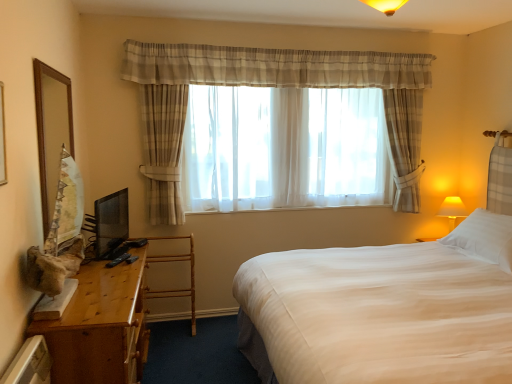
Question: Does sheer fabric bay window at center turn towards white soft pillow at upper right?

Choices:
 (A) yes
 (B) no

Answer: (A)

Question: Is there a large distance between sheer fabric bay window at center and white soft pillow at upper right?

Choices:
 (A) no
 (B) yes

Answer: (B)

Question: Does sheer fabric bay window at center have a lesser width compared to white soft pillow at upper right?

Choices:
 (A) yes
 (B) no

Answer: (A)

Question: Is sheer fabric bay window at center shorter than white soft pillow at upper right?

Choices:
 (A) no
 (B) yes

Answer: (A)

Question: From a real-world perspective, is sheer fabric bay window at center beneath white soft pillow at upper right?

Choices:
 (A) yes
 (B) no

Answer: (B)

Question: Is sheer fabric bay window at center surrounding white soft pillow at upper right?

Choices:
 (A) no
 (B) yes

Answer: (A)

Question: Does bamboo rack at left appear on the left side of white soft pillow at upper right?

Choices:
 (A) no
 (B) yes

Answer: (B)

Question: From a real-world perspective, is bamboo rack at left on white soft pillow at upper right?

Choices:
 (A) yes
 (B) no

Answer: (B)

Question: From a real-world perspective, is bamboo rack at left physically below white soft pillow at upper right?

Choices:
 (A) no
 (B) yes

Answer: (B)

Question: Can you confirm if bamboo rack at left is taller than white soft pillow at upper right?

Choices:
 (A) no
 (B) yes

Answer: (B)

Question: Is bamboo rack at left turned away from white soft pillow at upper right?

Choices:
 (A) yes
 (B) no

Answer: (B)

Question: Is bamboo rack at left next to white soft pillow at upper right?

Choices:
 (A) no
 (B) yes

Answer: (A)

Question: Is sheer fabric bay window at center with wooden desk at left?

Choices:
 (A) no
 (B) yes

Answer: (A)